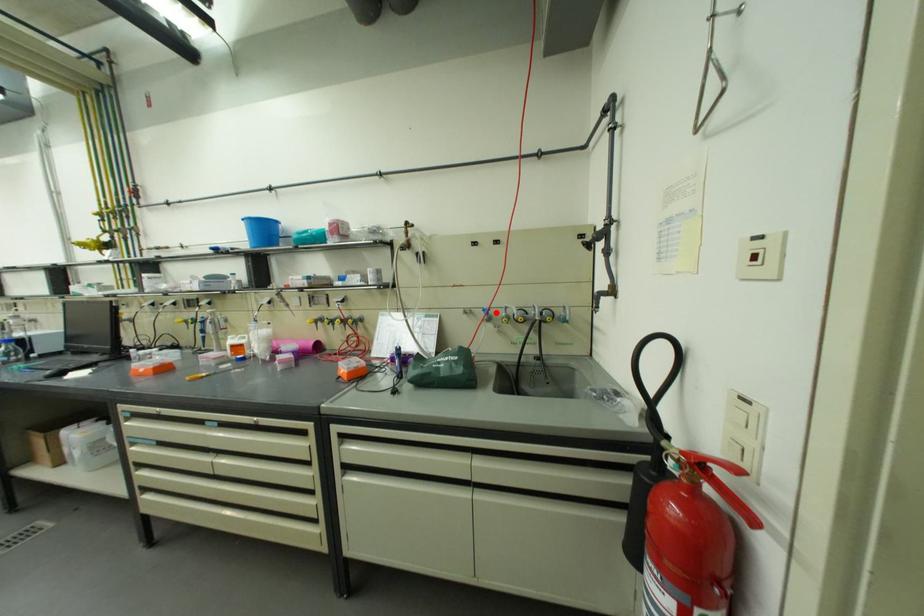
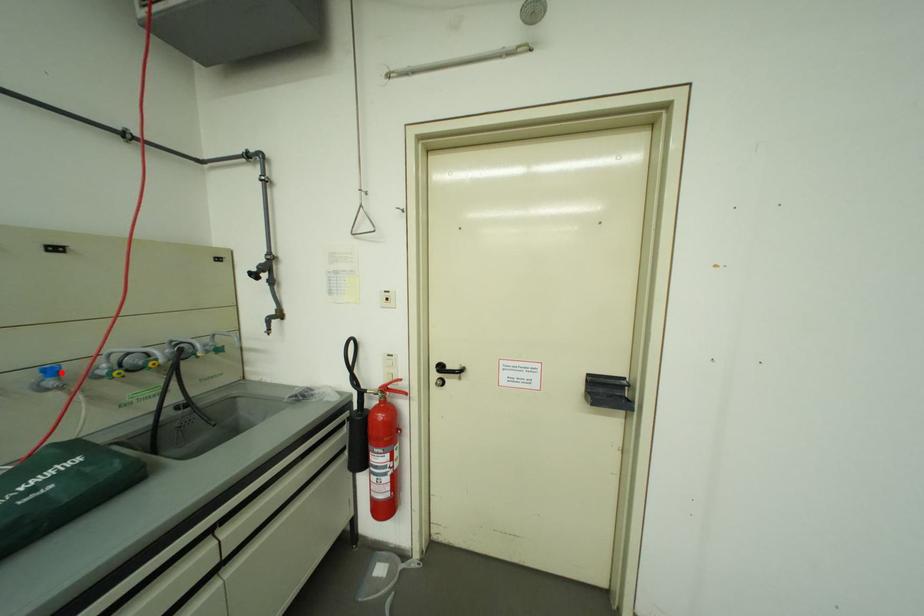
I am providing you with two images of the same scene from different viewpoints. A red point is marked on the first image and another point is marked on the second image. Is the marked point in image1 the same physical position as the marked point in image2?

Yes